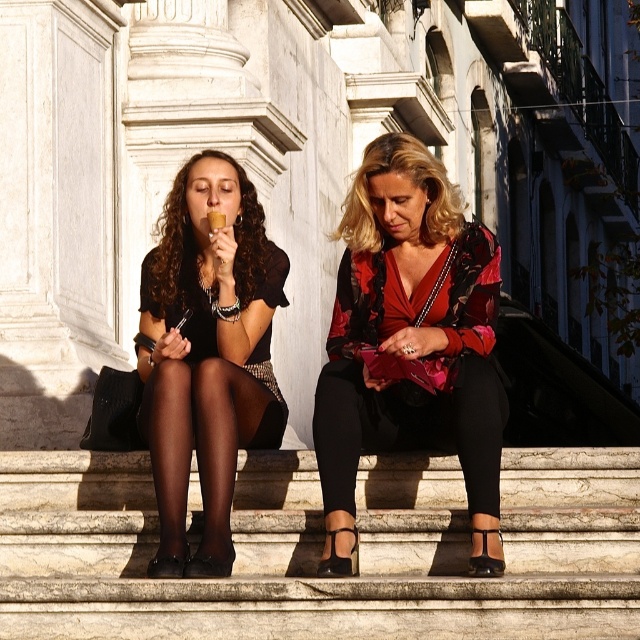
Question: Which of the following is the farthest from the observer?

Choices:
 (A) (330, 458)
 (B) (184, 435)

Answer: (B)

Question: Which point is closer to the camera taking this photo?

Choices:
 (A) (145, 440)
 (B) (404, 410)

Answer: (B)

Question: Can you confirm if shiny red fabric at center is wider than matte black dress at center?

Choices:
 (A) yes
 (B) no

Answer: (A)

Question: Can you confirm if shiny red fabric at center is thinner than matte black dress at center?

Choices:
 (A) no
 (B) yes

Answer: (A)

Question: Among these objects, which one is farthest from the camera?

Choices:
 (A) matte black dress at center
 (B) shiny red fabric at center

Answer: (A)

Question: Can you confirm if shiny red fabric at center is positioned to the right of matte black dress at center?

Choices:
 (A) yes
 (B) no

Answer: (A)